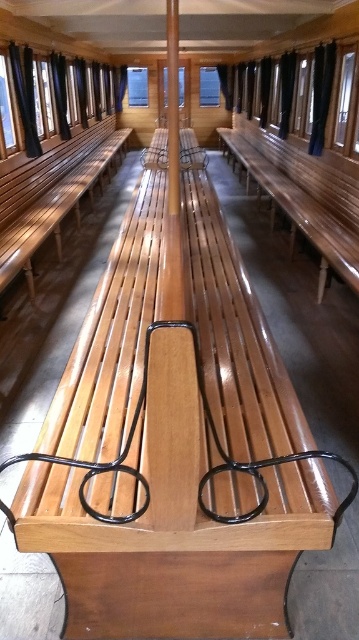
Who is positioned more to the right, glossy wood bench at center or wooden bench at center?

Positioned to the right is glossy wood bench at center.

What do you see at coordinates (304, 195) in the screenshot? I see `glossy wood bench at center` at bounding box center [304, 195].

The image size is (359, 640). Find the location of `glossy wood bench at center`. glossy wood bench at center is located at coordinates (304, 195).

Does glossy wood bench at center have a greater height compared to shiny brown wood bench at left?

No.

Who is shorter, glossy wood bench at center or shiny brown wood bench at left?

glossy wood bench at center is shorter.

In order to click on glossy wood bench at center in this screenshot , I will do `click(304, 195)`.

Identify the location of glossy wood bench at center. (304, 195).

Who is taller, shiny brown wood bench at left or wooden bench at center?

wooden bench at center

Is shiny brown wood bench at left taller than wooden bench at center?

No, shiny brown wood bench at left is not taller than wooden bench at center.

Is point (49, 164) behind point (198, 150)?

No, it is in front of (198, 150).

Where is `shiny brown wood bench at left`? shiny brown wood bench at left is located at coordinates tap(49, 193).